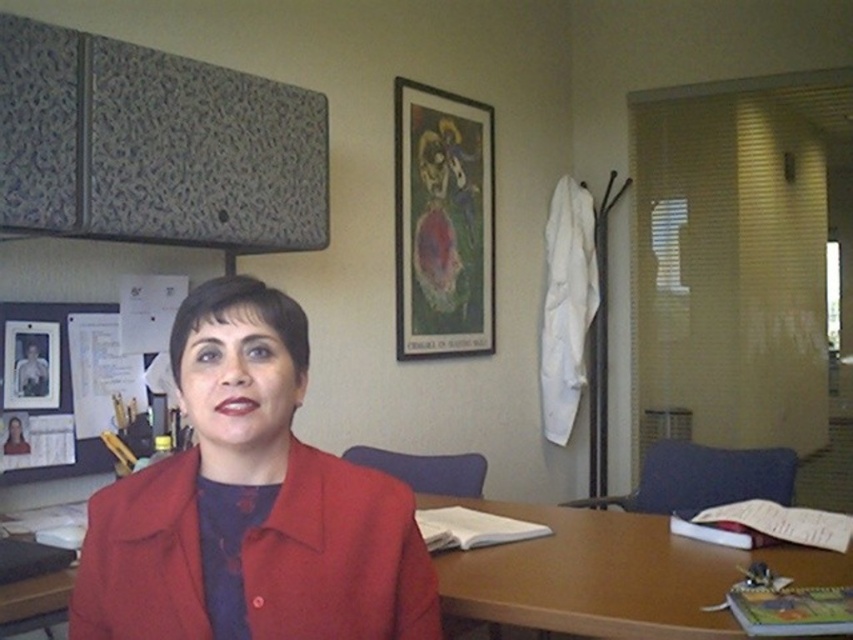
Question: Which of the following is the farthest from the observer?

Choices:
 (A) (473, 224)
 (B) (300, 518)
 (C) (53, 381)

Answer: (A)

Question: Can you confirm if matte red jacket at center is wider than matte black picture frame at upper center?

Choices:
 (A) no
 (B) yes

Answer: (B)

Question: Which object appears closest to the camera in this image?

Choices:
 (A) matte red jacket at center
 (B) brown wooden table at center

Answer: (A)

Question: Does matte red jacket at center have a lesser width compared to brown wooden table at center?

Choices:
 (A) yes
 (B) no

Answer: (A)

Question: Which object is farther from the camera taking this photo?

Choices:
 (A) metallic photo frame at upper left
 (B) matte black picture frame at upper center

Answer: (B)

Question: Can you confirm if matte red jacket at center is positioned below brown wooden table at center?

Choices:
 (A) no
 (B) yes

Answer: (A)